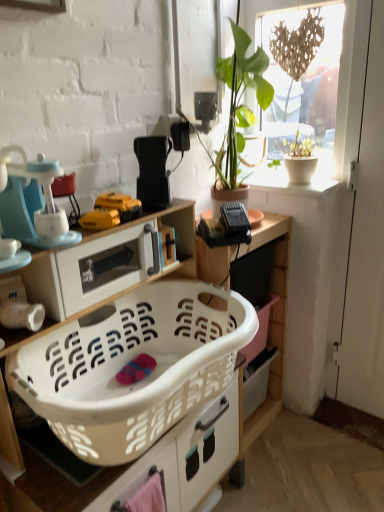
Identify the location of white matte screen door at right. (362, 227).

Describe the element at coordinates (88, 271) in the screenshot. I see `white glossy microwave at upper left, the third appliance when ordered from top to bottom` at that location.

This screenshot has height=512, width=384. What do you see at coordinates (34, 203) in the screenshot?
I see `matte blue blender at left, acting as the 2th appliance starting from the bottom` at bounding box center [34, 203].

You are a GUI agent. You are given a task and a screenshot of the screen. Output one action in this format:
    pyautogui.click(x=<x>, y=<y>)
    Task: Click on the black plastic toaster at upper center, the third appliance in the bottom-to-top sequence
    The width and height of the screenshot is (384, 512).
    Given the screenshot: What is the action you would take?
    tap(153, 170)

What are the coordinates of `yellow plastic drill at center, placed as the second toy when sorted from back to front` in the screenshot? It's located at (100, 219).

Is white glossy microwave at upper left, which is the first appliance from bottom to top, taller or shorter than white matte screen door at right?

white glossy microwave at upper left, which is the first appliance from bottom to top, is shorter than white matte screen door at right.

In the scene shown: From a real-world perspective, relative to white matte screen door at right, is white glossy microwave at upper left, which is the first appliance from bottom to top, vertically above or below?

From a real-world perspective, white glossy microwave at upper left, which is the first appliance from bottom to top, is physically above white matte screen door at right.

Considering the relative sizes of white glossy microwave at upper left, the third appliance when ordered from top to bottom, and white matte screen door at right in the image provided, is white glossy microwave at upper left, the third appliance when ordered from top to bottom, wider than white matte screen door at right?

Correct, the width of white glossy microwave at upper left, the third appliance when ordered from top to bottom, exceeds that of white matte screen door at right.

How far apart are white glossy microwave at upper left, which is the first appliance from bottom to top, and white matte screen door at right?

white glossy microwave at upper left, which is the first appliance from bottom to top, and white matte screen door at right are 3.31 feet apart.

From the image's perspective, does yellow plastic drill at center, the 1th toy viewed from the front, appear higher than matte blue blender at left, marked as the 2th appliance in a top-to-bottom arrangement?

No, from the image's perspective, yellow plastic drill at center, the 1th toy viewed from the front, is not above matte blue blender at left, marked as the 2th appliance in a top-to-bottom arrangement.

Is yellow plastic drill at center, the 1th toy viewed from the front, positioned beyond the bounds of matte blue blender at left, acting as the 2th appliance starting from the bottom?

That's correct, yellow plastic drill at center, the 1th toy viewed from the front, is outside of matte blue blender at left, acting as the 2th appliance starting from the bottom.

This screenshot has height=512, width=384. There is a matte blue blender at left, acting as the 2th appliance starting from the bottom. Find the location of `the 2nd toy below it (from a real-world perspective)`. the 2nd toy below it (from a real-world perspective) is located at coordinates (100, 219).

Is point (102, 213) farther from camera compared to point (71, 236)?

Yes, it is.

Locate an element on the screen. This screenshot has height=512, width=384. the 2nd appliance behind the matte blue blender at left, marked as the 2th appliance in a top-to-bottom arrangement, starting your count from the anchor is located at coordinates (153, 170).

In the image, is matte blue blender at left, marked as the 2th appliance in a top-to-bottom arrangement, positioned in front of or behind black plastic toaster at upper center, the third appliance in the bottom-to-top sequence?

In the image, matte blue blender at left, marked as the 2th appliance in a top-to-bottom arrangement, appears in front of black plastic toaster at upper center, the third appliance in the bottom-to-top sequence.

Looking at this image, is the surface of matte blue blender at left, marked as the 2th appliance in a top-to-bottom arrangement, in direct contact with black plastic toaster at upper center, positioned as the 1th appliance in top-to-bottom order?

No, matte blue blender at left, marked as the 2th appliance in a top-to-bottom arrangement, is not next to black plastic toaster at upper center, positioned as the 1th appliance in top-to-bottom order.

From a real-world perspective, is matte blue blender at left, marked as the 2th appliance in a top-to-bottom arrangement, positioned over black plastic toaster at upper center, positioned as the 1th appliance in top-to-bottom order, based on gravity?

Indeed, from a real-world perspective, matte blue blender at left, marked as the 2th appliance in a top-to-bottom arrangement, stands above black plastic toaster at upper center, positioned as the 1th appliance in top-to-bottom order.

Locate an element on the screen. The height and width of the screenshot is (512, 384). appliance behind the white glossy microwave at upper left, which is the first appliance from bottom to top is located at coordinates (153, 170).

Which object is more forward, black plastic toaster at upper center, positioned as the 1th appliance in top-to-bottom order, or white glossy microwave at upper left, the third appliance when ordered from top to bottom?

white glossy microwave at upper left, the third appliance when ordered from top to bottom, is in front.

From the image's perspective, between black plastic toaster at upper center, positioned as the 1th appliance in top-to-bottom order, and white glossy microwave at upper left, which is the first appliance from bottom to top, which one is located above?

black plastic toaster at upper center, positioned as the 1th appliance in top-to-bottom order.

From a real-world perspective, does black plastic toaster at upper center, the third appliance in the bottom-to-top sequence, stand above white glossy microwave at upper left, the third appliance when ordered from top to bottom?

Yes.

From the image's perspective, would you say white plastic cabinet at center, which ranks as the second cabinetry in front-to-back order, is positioned over matte blue blender at left, acting as the 2th appliance starting from the bottom?

No.

From a real-world perspective, is white plastic cabinet at center, which ranks as the second cabinetry in front-to-back order, below matte blue blender at left, acting as the 2th appliance starting from the bottom?

Yes, from a real-world perspective, white plastic cabinet at center, which ranks as the second cabinetry in front-to-back order, is under matte blue blender at left, acting as the 2th appliance starting from the bottom.

Is matte blue blender at left, acting as the 2th appliance starting from the bottom, surrounded by white plastic cabinet at center, the first cabinetry positioned from the back?

Actually, matte blue blender at left, acting as the 2th appliance starting from the bottom, is outside white plastic cabinet at center, the first cabinetry positioned from the back.

From the image's perspective, does white plastic cabinet at center, the first cabinetry positioned from the back, appear higher than transparent glass window at upper right?

No, from the image's perspective, white plastic cabinet at center, the first cabinetry positioned from the back, is not on top of transparent glass window at upper right.

Is white plastic cabinet at center, the first cabinetry positioned from the back, positioned behind transparent glass window at upper right?

No, white plastic cabinet at center, the first cabinetry positioned from the back, is in front of transparent glass window at upper right.

This screenshot has height=512, width=384. What are the coordinates of `window above the white plastic cabinet at center, which ranks as the second cabinetry in front-to-back order (from a real-world perspective)` in the screenshot? It's located at (346, 95).

Would you consider yellow plastic drill at center, placed as the second toy when sorted from back to front, to be distant from green leafy plant at upper right?

They are positioned close to each other.

Is yellow plastic drill at center, the 1th toy viewed from the front, shorter than green leafy plant at upper right?

Yes, yellow plastic drill at center, the 1th toy viewed from the front, is shorter than green leafy plant at upper right.

From the image's perspective, between yellow plastic drill at center, placed as the second toy when sorted from back to front, and green leafy plant at upper right, who is located below?

yellow plastic drill at center, placed as the second toy when sorted from back to front.

From the white matte screen door at right, count the 2nd appliance to the left and point to it. Please provide its 2D coordinates.

[(88, 271)]

You are a GUI agent. You are given a task and a screenshot of the screen. Output one action in this format:
    pyautogui.click(x=<x>, y=<y>)
    Task: Click on the toy lying below the matte blue blender at left, marked as the 2th appliance in a top-to-bottom arrangement (from the image's perspective)
    
    Given the screenshot: What is the action you would take?
    pyautogui.click(x=100, y=219)

Estimate the real-world distances between objects in this image. Which object is further from yellow plastic drill at center, placed as the second toy when sorted from back to front, white plastic cabinet at center, the first cabinetry positioned from the back, or matte blue blender at left, acting as the 2th appliance starting from the bottom?

white plastic cabinet at center, the first cabinetry positioned from the back.

When comparing their distances from white matte screen door at right, does yellow plastic drill at center, placed as the second toy when sorted from back to front, or white plastic cabinet at center, which ranks as the second cabinetry in front-to-back order, seem further?

The object further to white matte screen door at right is yellow plastic drill at center, placed as the second toy when sorted from back to front.

Estimate the real-world distances between objects in this image. Which object is further from white plastic laundry basket at lower center, placed as the 1th cabinetry when sorted from front to back, green leafy plant at upper right or yellow plastic drill at center, placed as the second toy when sorted from back to front?

green leafy plant at upper right is further to white plastic laundry basket at lower center, placed as the 1th cabinetry when sorted from front to back.

Looking at the image, which one is located closer to white plastic cabinet at center, which ranks as the second cabinetry in front-to-back order, yellow plastic drill at center, which is the first toy in back-to-front order, or white plastic laundry basket at lower center, placed as the 1th cabinetry when sorted from front to back?

white plastic laundry basket at lower center, placed as the 1th cabinetry when sorted from front to back, is positioned closer to the anchor white plastic cabinet at center, which ranks as the second cabinetry in front-to-back order.

Considering their positions, is white glossy microwave at upper left, the third appliance when ordered from top to bottom, positioned closer to green leafy plant at upper right than yellow plastic drill at center, placed as the second toy when sorted from back to front?

white glossy microwave at upper left, the third appliance when ordered from top to bottom, lies closer to green leafy plant at upper right than the other object.

When comparing their distances from white plastic laundry basket at lower center, placed as the 1th cabinetry when sorted from front to back, does transparent glass window at upper right or white matte screen door at right seem closer?

transparent glass window at upper right is positioned closer to the anchor white plastic laundry basket at lower center, placed as the 1th cabinetry when sorted from front to back.

Consider the image. Based on their spatial positions, is white plastic cabinet at center, the first cabinetry positioned from the back, or white matte screen door at right closer to white plastic laundry basket at lower center, placed as the second cabinetry when sorted from back to front?

white plastic cabinet at center, the first cabinetry positioned from the back, lies closer to white plastic laundry basket at lower center, placed as the second cabinetry when sorted from back to front, than the other object.

Considering their positions, is white plastic laundry basket at lower center, placed as the second cabinetry when sorted from back to front, positioned closer to black plastic toaster at upper center, positioned as the 1th appliance in top-to-bottom order, than white plastic cabinet at center, which ranks as the second cabinetry in front-to-back order?

white plastic laundry basket at lower center, placed as the second cabinetry when sorted from back to front, is closer to black plastic toaster at upper center, positioned as the 1th appliance in top-to-bottom order.

Identify the location of appliance between yellow plastic drill at center, the 1th toy viewed from the front, and green leafy plant at upper right, in the horizontal direction. (153, 170).

Where is `window situated between yellow plastic drill at center, which ranks as the 2th toy in front-to-back order, and white matte screen door at right from left to right`? window situated between yellow plastic drill at center, which ranks as the 2th toy in front-to-back order, and white matte screen door at right from left to right is located at coordinates (346, 95).

Identify the location of window located between matte blue blender at left, marked as the 2th appliance in a top-to-bottom arrangement, and white matte screen door at right in the left-right direction. Image resolution: width=384 pixels, height=512 pixels. (346, 95).

Image resolution: width=384 pixels, height=512 pixels. Find the location of `cabinetry between black plastic toaster at upper center, the third appliance in the bottom-to-top sequence, and white matte screen door at right`. cabinetry between black plastic toaster at upper center, the third appliance in the bottom-to-top sequence, and white matte screen door at right is located at coordinates (270, 311).